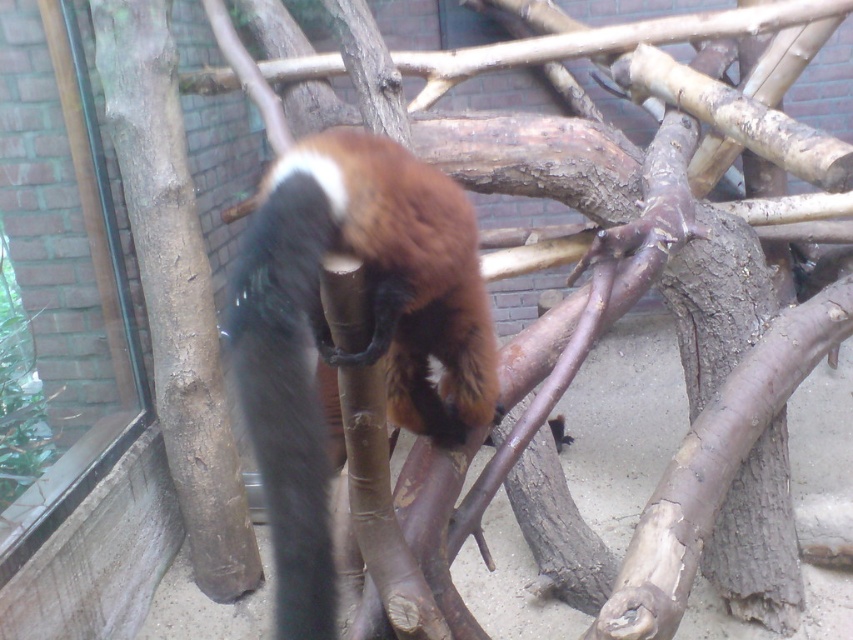
Where is `brown furry animal at center`? The image size is (853, 640). brown furry animal at center is located at coordinates (370, 332).

Between point (409, 248) and point (209, 330), which one is positioned behind?

The point (209, 330) is behind.

The image size is (853, 640). What are the coordinates of `brown furry animal at center` in the screenshot? It's located at (370, 332).

The width and height of the screenshot is (853, 640). Identify the location of brown furry animal at center. (370, 332).